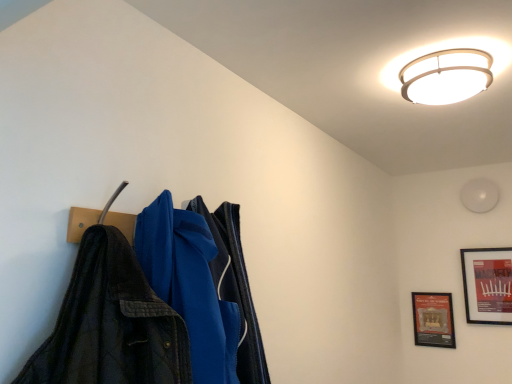
What is the approximate height of wooden framed poster at lower right, which appears as the 2th picture frame when viewed from the right?

12.98 inches.

Locate an element on the screen. This screenshot has height=384, width=512. white glossy ceiling light at upper center is located at coordinates (446, 76).

Is white glossy ceiling light at upper center thinner than white matte light fixture at upper right?

Incorrect, the width of white glossy ceiling light at upper center is not less than that of white matte light fixture at upper right.

Based on the photo, from a real-world perspective, is white glossy ceiling light at upper center located higher than white matte light fixture at upper right?

Yes, from a real-world perspective, white glossy ceiling light at upper center is on top of white matte light fixture at upper right.

Is white matte light fixture at upper right completely or partially inside white glossy ceiling light at upper center?

No, white matte light fixture at upper right is located outside of white glossy ceiling light at upper center.

From the image's perspective, is white glossy ceiling light at upper center on top of white matte light fixture at upper right?

Yes, from the image's perspective, white glossy ceiling light at upper center is above white matte light fixture at upper right.

Considering the relative positions of matte black picture frame at upper right, positioned as the 2th picture frame in left-to-right order, and white matte light fixture at upper right in the image provided, is matte black picture frame at upper right, positioned as the 2th picture frame in left-to-right order, to the left of white matte light fixture at upper right from the viewer's perspective?

In fact, matte black picture frame at upper right, positioned as the 2th picture frame in left-to-right order, is to the right of white matte light fixture at upper right.

Can you see matte black picture frame at upper right, which is the first picture frame from right to left, touching white matte light fixture at upper right?

Result: No, matte black picture frame at upper right, which is the first picture frame from right to left, is not beside white matte light fixture at upper right.

Considering the sizes of objects matte black picture frame at upper right, positioned as the 2th picture frame in left-to-right order, and white matte light fixture at upper right in the image provided, who is wider, matte black picture frame at upper right, positioned as the 2th picture frame in left-to-right order, or white matte light fixture at upper right?

white matte light fixture at upper right.

Is matte black picture frame at upper right, which is the first picture frame from right to left, taller than white matte light fixture at upper right?

Yes.

Looking at the image, does wooden framed poster at lower right, which appears as the 2th picture frame when viewed from the right, seem bigger or smaller compared to matte black picture frame at upper right, which is the first picture frame from right to left?

wooden framed poster at lower right, which appears as the 2th picture frame when viewed from the right, is smaller than matte black picture frame at upper right, which is the first picture frame from right to left.

Which of these two, wooden framed poster at lower right, which appears as the 2th picture frame when viewed from the right, or matte black picture frame at upper right, which is the first picture frame from right to left, stands taller?

matte black picture frame at upper right, which is the first picture frame from right to left, is taller.

From the image's perspective, is wooden framed poster at lower right, which appears as the 1th picture frame when viewed from the left, located above or below matte black picture frame at upper right, which is the first picture frame from right to left?

Clearly, from the image's perspective, wooden framed poster at lower right, which appears as the 1th picture frame when viewed from the left, is below matte black picture frame at upper right, which is the first picture frame from right to left.

In the scene shown: Which is correct: wooden framed poster at lower right, which appears as the 2th picture frame when viewed from the right, is inside matte black picture frame at upper right, which is the first picture frame from right to left, or outside of it?

wooden framed poster at lower right, which appears as the 2th picture frame when viewed from the right, cannot be found inside matte black picture frame at upper right, which is the first picture frame from right to left.

From the image's perspective, between wooden framed poster at lower right, which appears as the 2th picture frame when viewed from the right, and white matte light fixture at upper right, who is located below?

wooden framed poster at lower right, which appears as the 2th picture frame when viewed from the right.

Which object is further away from the camera, wooden framed poster at lower right, which appears as the 1th picture frame when viewed from the left, or white matte light fixture at upper right?

wooden framed poster at lower right, which appears as the 1th picture frame when viewed from the left, is behind.

Is wooden framed poster at lower right, which appears as the 1th picture frame when viewed from the left, inside or outside of white matte light fixture at upper right?

wooden framed poster at lower right, which appears as the 1th picture frame when viewed from the left, lies outside white matte light fixture at upper right.

From a real-world perspective, is white glossy ceiling light at upper center above or below wooden framed poster at lower right, which appears as the 1th picture frame when viewed from the left?

white glossy ceiling light at upper center is situated higher than wooden framed poster at lower right, which appears as the 1th picture frame when viewed from the left, in the real world.

Between white glossy ceiling light at upper center and wooden framed poster at lower right, which appears as the 2th picture frame when viewed from the right, which one has larger width?

white glossy ceiling light at upper center.

In the scene shown: Measure the distance from white glossy ceiling light at upper center to wooden framed poster at lower right, which appears as the 1th picture frame when viewed from the left.

They are 5.63 feet apart.

Locate an element on the screen. The height and width of the screenshot is (384, 512). lamp that appears on the left of wooden framed poster at lower right, which appears as the 1th picture frame when viewed from the left is located at coordinates (446, 76).

Which is correct: matte black picture frame at upper right, which is the first picture frame from right to left, is inside wooden framed poster at lower right, which appears as the 2th picture frame when viewed from the right, or outside of it?

matte black picture frame at upper right, which is the first picture frame from right to left, is not inside wooden framed poster at lower right, which appears as the 2th picture frame when viewed from the right, it's outside.

Is there a large distance between matte black picture frame at upper right, which is the first picture frame from right to left, and wooden framed poster at lower right, which appears as the 2th picture frame when viewed from the right?

No, matte black picture frame at upper right, which is the first picture frame from right to left, is not far away from wooden framed poster at lower right, which appears as the 2th picture frame when viewed from the right.

Is white glossy ceiling light at upper center inside or outside of matte black picture frame at upper right, which is the first picture frame from right to left?

white glossy ceiling light at upper center is not inside matte black picture frame at upper right, which is the first picture frame from right to left, it's outside.

At what (x,y) coordinates should I click in order to perform the action: click on lamp located above the matte black picture frame at upper right, which is the first picture frame from right to left (from the image's perspective). Please return your answer as a coordinate pair (x, y). Looking at the image, I should click on (446, 76).

Would you say white glossy ceiling light at upper center is a long distance from matte black picture frame at upper right, which is the first picture frame from right to left?

Yes, white glossy ceiling light at upper center and matte black picture frame at upper right, which is the first picture frame from right to left, are quite far apart.

Could you measure the distance between white glossy ceiling light at upper center and matte black picture frame at upper right, positioned as the 2th picture frame in left-to-right order?

white glossy ceiling light at upper center and matte black picture frame at upper right, positioned as the 2th picture frame in left-to-right order, are 5.14 feet apart.

I want to click on lamp that appears above the white matte light fixture at upper right (from a real-world perspective), so click(446, 76).

Where is `picture frame that is the 1st one when counting downward from the white matte light fixture at upper right (from the image's perspective)`? Image resolution: width=512 pixels, height=384 pixels. picture frame that is the 1st one when counting downward from the white matte light fixture at upper right (from the image's perspective) is located at coordinates (487, 285).

Which object lies nearer to the anchor point white matte light fixture at upper right, wooden framed poster at lower right, which appears as the 1th picture frame when viewed from the left, or white glossy ceiling light at upper center?

Among the two, wooden framed poster at lower right, which appears as the 1th picture frame when viewed from the left, is located nearer to white matte light fixture at upper right.

In the scene shown: Looking at the image, which one is located closer to wooden framed poster at lower right, which appears as the 2th picture frame when viewed from the right, white matte light fixture at upper right or matte black picture frame at upper right, which is the first picture frame from right to left?

matte black picture frame at upper right, which is the first picture frame from right to left, lies closer to wooden framed poster at lower right, which appears as the 2th picture frame when viewed from the right, than the other object.

Which object lies further to the anchor point wooden framed poster at lower right, which appears as the 2th picture frame when viewed from the right, white glossy ceiling light at upper center or matte black picture frame at upper right, which is the first picture frame from right to left?

white glossy ceiling light at upper center is positioned further to the anchor wooden framed poster at lower right, which appears as the 2th picture frame when viewed from the right.

Looking at the image, which one is located closer to white matte light fixture at upper right, wooden framed poster at lower right, which appears as the 2th picture frame when viewed from the right, or matte black picture frame at upper right, positioned as the 2th picture frame in left-to-right order?

matte black picture frame at upper right, positioned as the 2th picture frame in left-to-right order, lies closer to white matte light fixture at upper right than the other object.

Considering their positions, is matte black picture frame at upper right, which is the first picture frame from right to left, positioned further to wooden framed poster at lower right, which appears as the 2th picture frame when viewed from the right, than white matte light fixture at upper right?

white matte light fixture at upper right is positioned further to the anchor wooden framed poster at lower right, which appears as the 2th picture frame when viewed from the right.

Looking at the image, which one is located further to matte black picture frame at upper right, which is the first picture frame from right to left, wooden framed poster at lower right, which appears as the 1th picture frame when viewed from the left, or white matte light fixture at upper right?

white matte light fixture at upper right.

Considering their positions, is white matte light fixture at upper right positioned closer to white glossy ceiling light at upper center than matte black picture frame at upper right, which is the first picture frame from right to left?

Among the two, white matte light fixture at upper right is located nearer to white glossy ceiling light at upper center.

When comparing their distances from wooden framed poster at lower right, which appears as the 2th picture frame when viewed from the right, does white matte light fixture at upper right or white glossy ceiling light at upper center seem further?

white glossy ceiling light at upper center is further to wooden framed poster at lower right, which appears as the 2th picture frame when viewed from the right.

Identify the location of picture frame positioned between white glossy ceiling light at upper center and white matte light fixture at upper right from near to far. This screenshot has height=384, width=512. (487, 285).

This screenshot has height=384, width=512. Find the location of `picture frame between white matte light fixture at upper right and wooden framed poster at lower right, which appears as the 2th picture frame when viewed from the right, in the up-down direction`. picture frame between white matte light fixture at upper right and wooden framed poster at lower right, which appears as the 2th picture frame when viewed from the right, in the up-down direction is located at coordinates (487, 285).

Find the location of a particular element. The image size is (512, 384). light between white glossy ceiling light at upper center and wooden framed poster at lower right, which appears as the 2th picture frame when viewed from the right, in the front-back direction is located at coordinates (479, 195).

You are a GUI agent. You are given a task and a screenshot of the screen. Output one action in this format:
    pyautogui.click(x=<x>, y=<y>)
    Task: Click on the picture frame located between white glossy ceiling light at upper center and wooden framed poster at lower right, which appears as the 2th picture frame when viewed from the right, in the depth direction
    Image resolution: width=512 pixels, height=384 pixels.
    Given the screenshot: What is the action you would take?
    pyautogui.click(x=487, y=285)